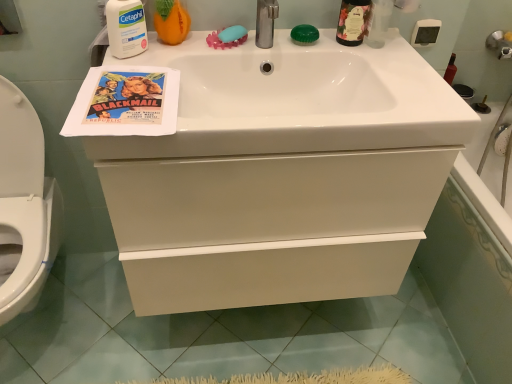
I want to click on free point to the left of green glass bottle at upper right, so click(306, 40).